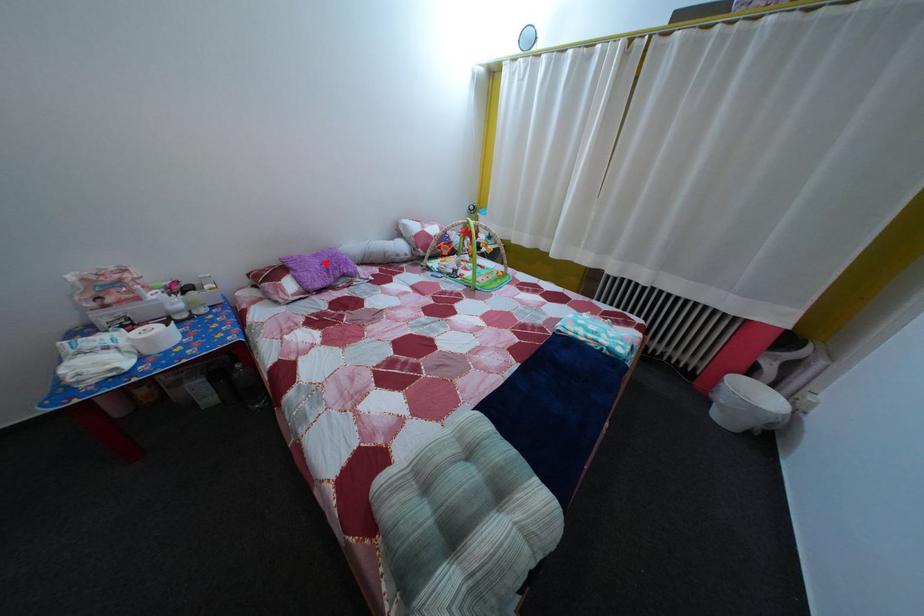
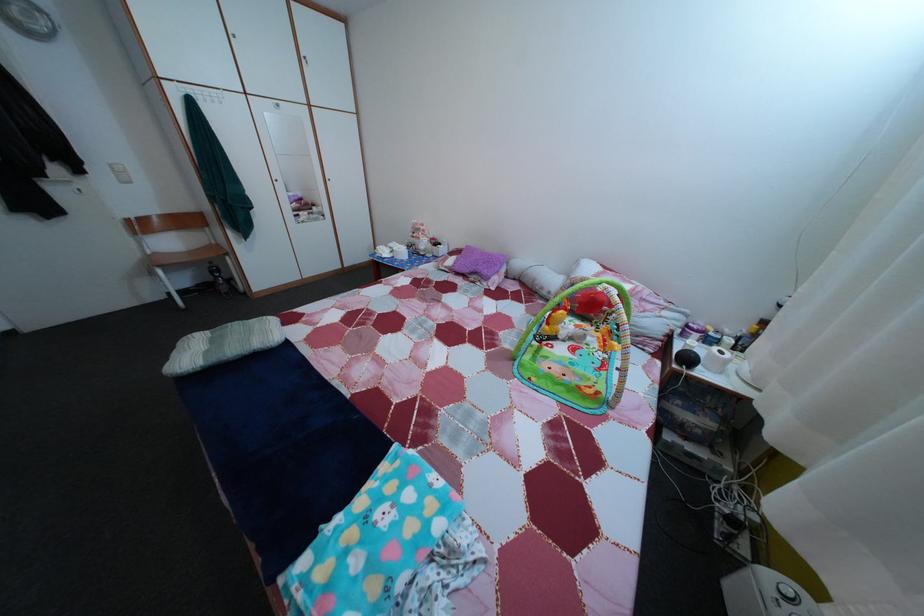
In the second image, find the point that corresponds to the highlighted location in the first image.

(492, 261)